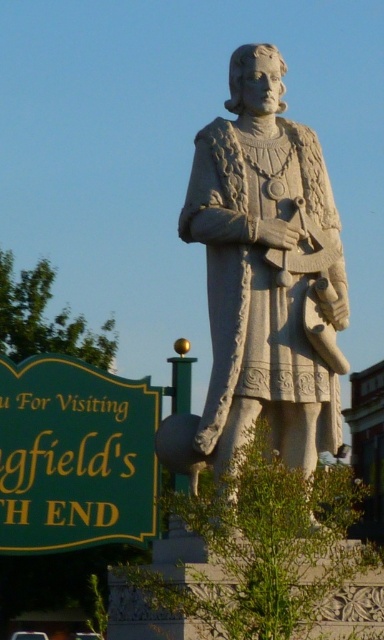
Question: Which point is closer to the camera?

Choices:
 (A) white stone statue at center
 (B) green painted wood sign at lower left

Answer: (A)

Question: Among these objects, which one is farthest from the camera?

Choices:
 (A) green painted wood sign at lower left
 (B) white stone statue at center

Answer: (A)

Question: Is white stone statue at center thinner than green painted wood sign at lower left?

Choices:
 (A) yes
 (B) no

Answer: (A)

Question: Is white stone statue at center wider than green painted wood sign at lower left?

Choices:
 (A) no
 (B) yes

Answer: (A)

Question: Is white stone statue at center wider than green painted wood sign at lower left?

Choices:
 (A) yes
 (B) no

Answer: (B)